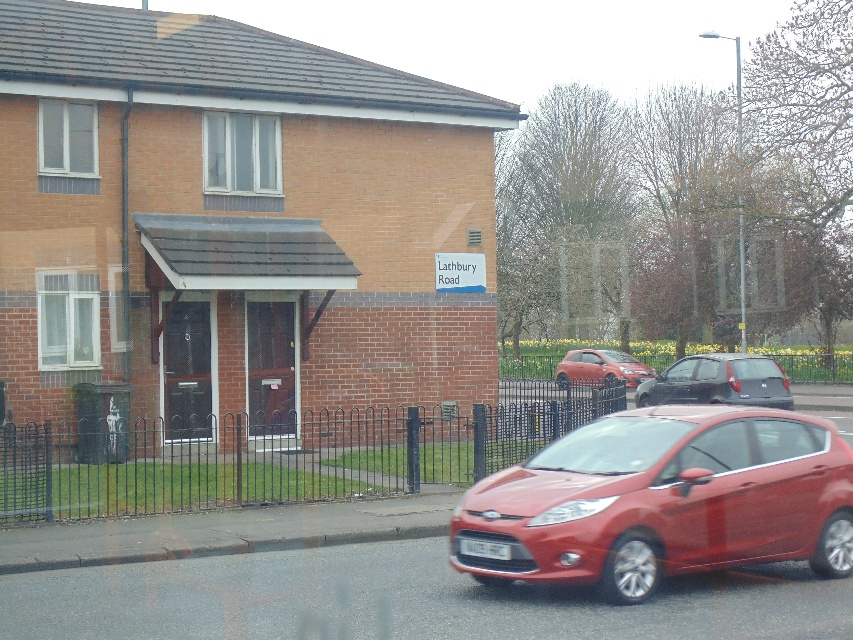
You are a delivery person trying to park your van in the driveway of the house on Lathbury Road. You notice the metallic red hatchback at center and the white plastic license plate at center. Which object should you avoid hitting when pulling into the driveway?

You should avoid hitting the metallic red hatchback at center because it is parked in the driveway and is closer to the entrance. The white plastic license plate at center is part of the car and not an obstacle to avoid.

You are a delivery person trying to park your vehicle between the matte red car at lower right and the satin black hatchback at center. The space between them is 2 meters wide. Your vehicle is 1.8 meters wide. Can you safely park there?

The space between the matte red car at lower right and the satin black hatchback at center is 2 meters wide. Since your vehicle is 1.8 meters wide, which is narrower than the available space, you can safely park there.